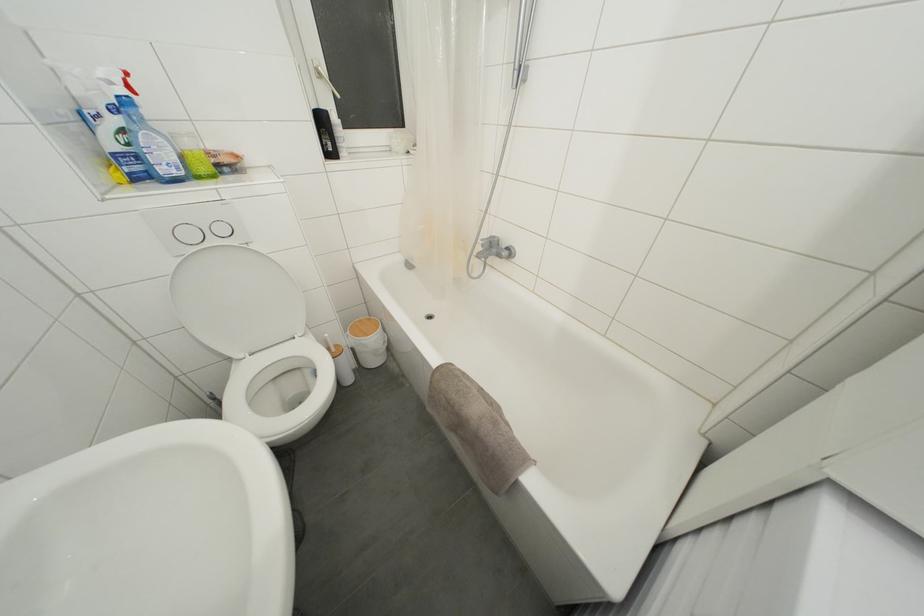
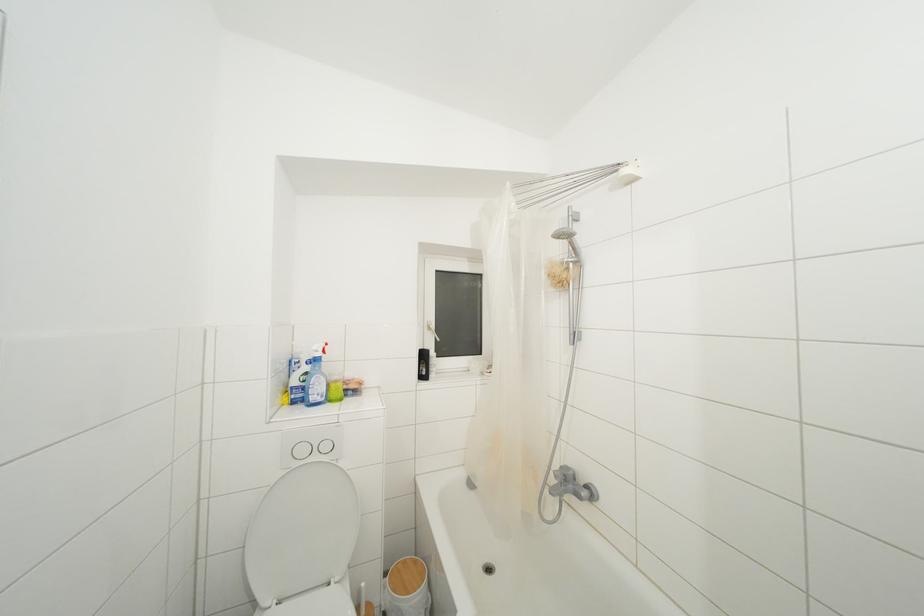
In the second image, find the point that corresponds to (195,240) in the first image.

(307, 456)